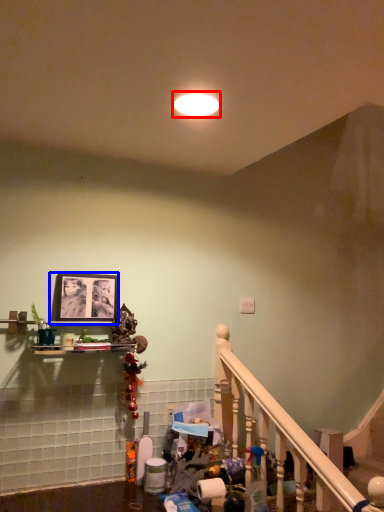
Question: Among these objects, which one is nearest to the camera, lighting (highlighted by a red box) or picture frame (highlighted by a blue box)?

Choices:
 (A) lighting
 (B) picture frame

Answer: (A)